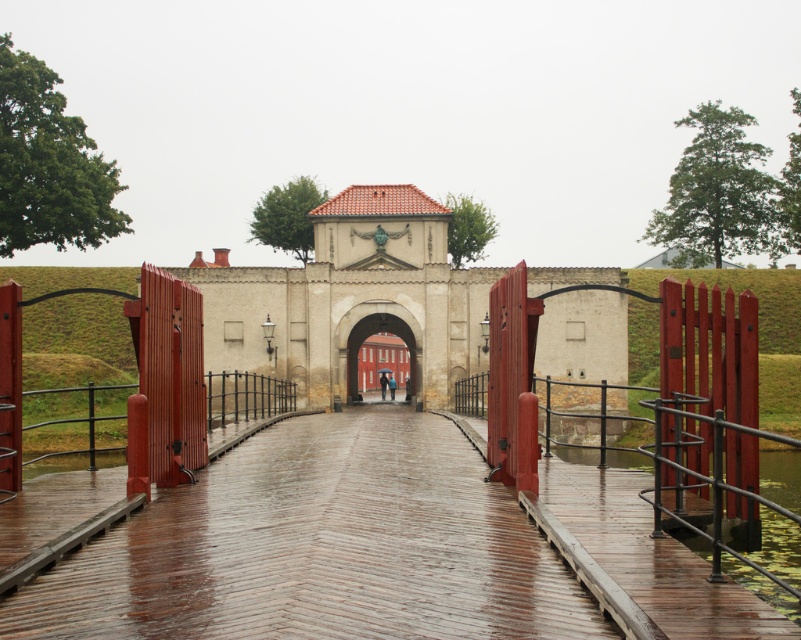
You are standing at the entrance of the historical fortification and need to cross the wet wooden bridge at center. What are the coordinates of the bridge to navigate towards it?

The wet wooden bridge at center is located at coordinates point (x=320, y=547).

You are a tourist visiting the historical site and want to cross from the drawbridge to the gate. Given the sizes of the wet wooden bridge at center and the red wooden gate at center, which one do you think you will step onto first?

The wet wooden bridge at center is smaller than the red wooden gate at center, so you will step onto the wet wooden bridge at center first as it is closer to the entrance.